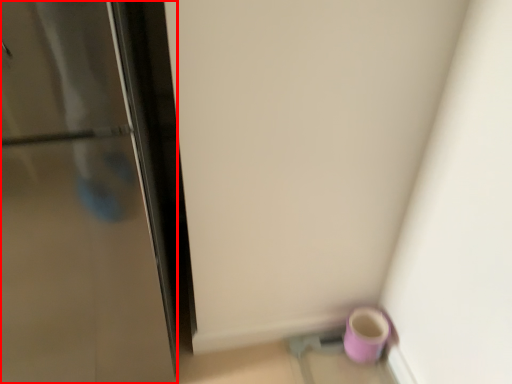
Question: From the image's perspective, what is the correct spatial positioning of door (annotated by the red box) in reference to mug?

Choices:
 (A) below
 (B) above

Answer: (B)